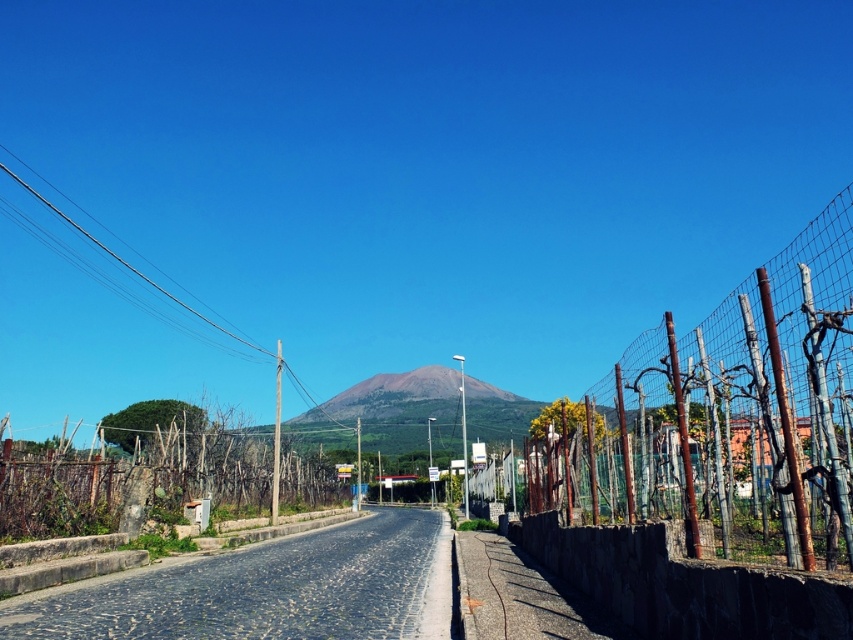
You are a painter setting up your easel on the side of the road. You want to paint the two wire mesh fences in the scene. Which fence, the rusty wire mesh fence at right or the wire mesh fence at center, should you focus on if you want to paint the wider one?

The wire mesh fence at center is wider than the rusty wire mesh fence at right, so you should focus on painting the wire mesh fence at center.

You are standing at the starting point of the road in the rural scene. There are two points marked on the road ahead. The first point is at coordinates point (834, 365) and the second is at point (248, 480). Which point will you encounter first as you walk along the road?

You will encounter point (834, 365) first because it is in front of point (248, 480) along the road.

You are standing at the center of the road in the image. Which direction should you walk to reach the rusty wire mesh fence at right?

You should walk to the right to reach the rusty wire mesh fence at right because it is located on the right side of the road.